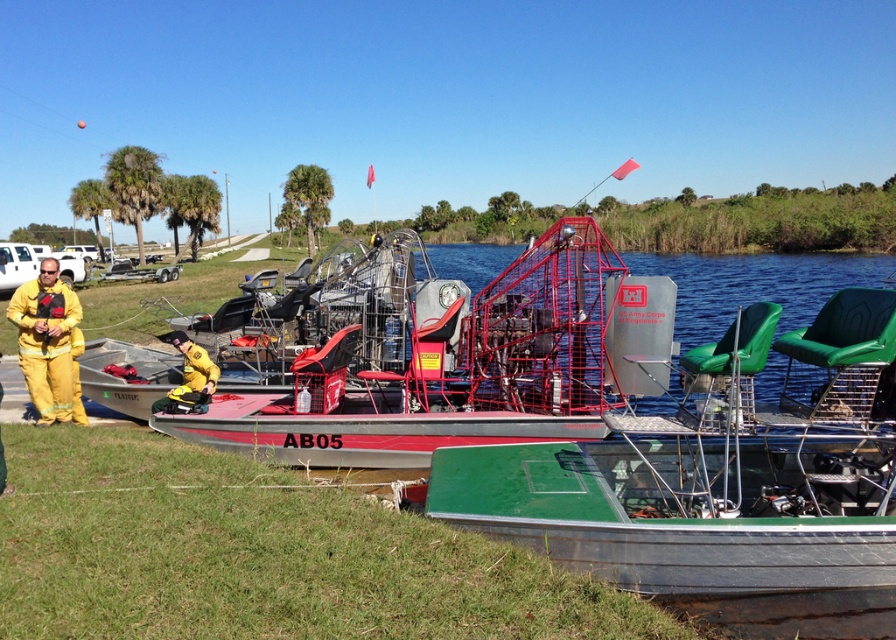
Find the location of `red matte airboat at center`. red matte airboat at center is located at coordinates (434, 358).

Can you confirm if red matte airboat at center is positioned below yellow fireproof suit at left?

Actually, red matte airboat at center is above yellow fireproof suit at left.

Measure the distance between point (548, 273) and camera.

Point (548, 273) and camera are 8.80 meters apart from each other.

This screenshot has width=896, height=640. Identify the location of red matte airboat at center. pyautogui.click(x=434, y=358).

Is green grass at lower left positioned at the back of yellow fireproof suit at left?

No, green grass at lower left is in front of yellow fireproof suit at left.

Which of these two, green grass at lower left or yellow fireproof suit at left, stands shorter?

Standing shorter between the two is green grass at lower left.

Where is `green grass at lower left`? The height and width of the screenshot is (640, 896). green grass at lower left is located at coordinates (259, 554).

Measure the distance between green grass at lower left and camera.

The distance of green grass at lower left from camera is 3.71 meters.

Can you confirm if green grass at lower left is positioned below red matte airboat at center?

Yes.

Where is `green grass at lower left`? green grass at lower left is located at coordinates (259, 554).